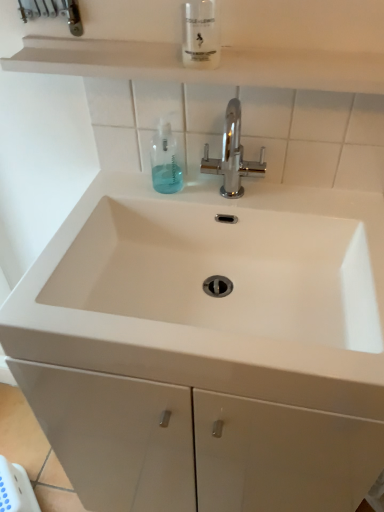
The width and height of the screenshot is (384, 512). Find the location of `free space to the right of clear plastic bottle at upper center, which is the first mouthwash from top to bottom`. free space to the right of clear plastic bottle at upper center, which is the first mouthwash from top to bottom is located at coordinates (283, 55).